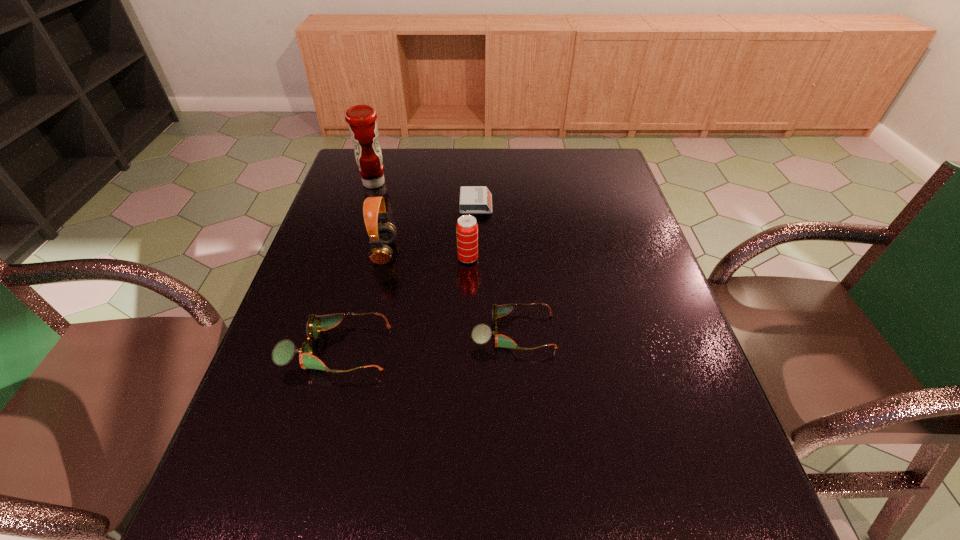
In order to click on free space for a new spectacles on the right in this screenshot , I will do `click(680, 316)`.